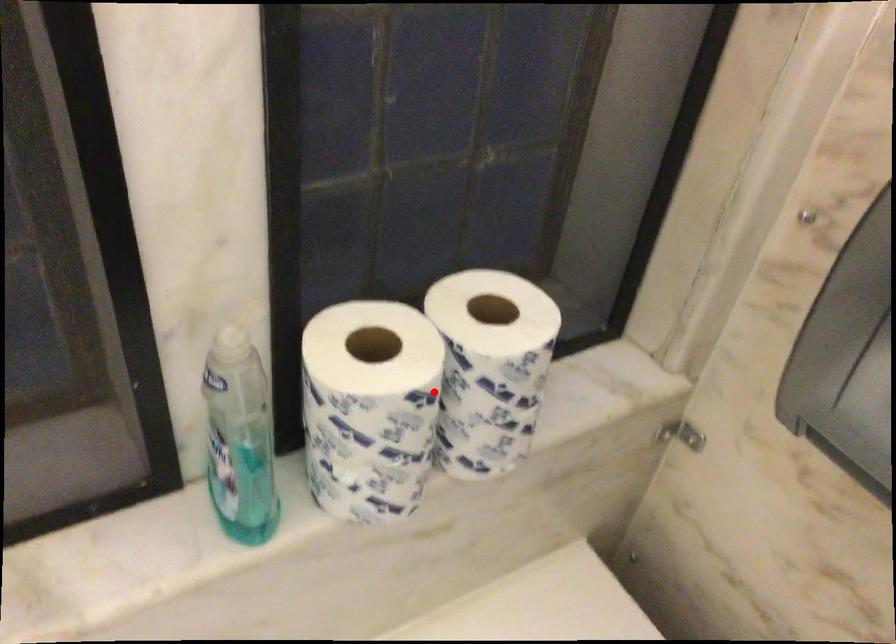
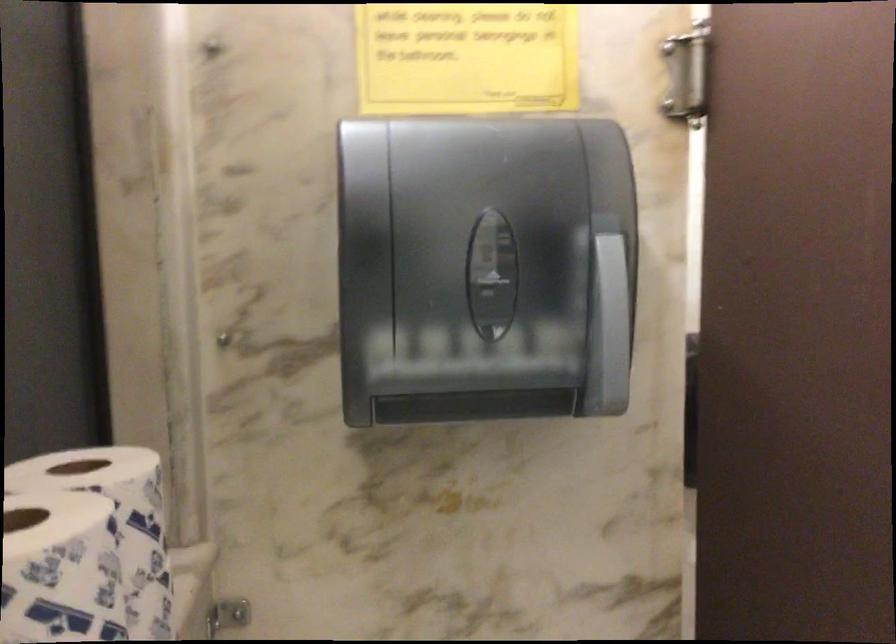
In the second image, find the point that corresponds to the highlighted location in the first image.

(117, 522)